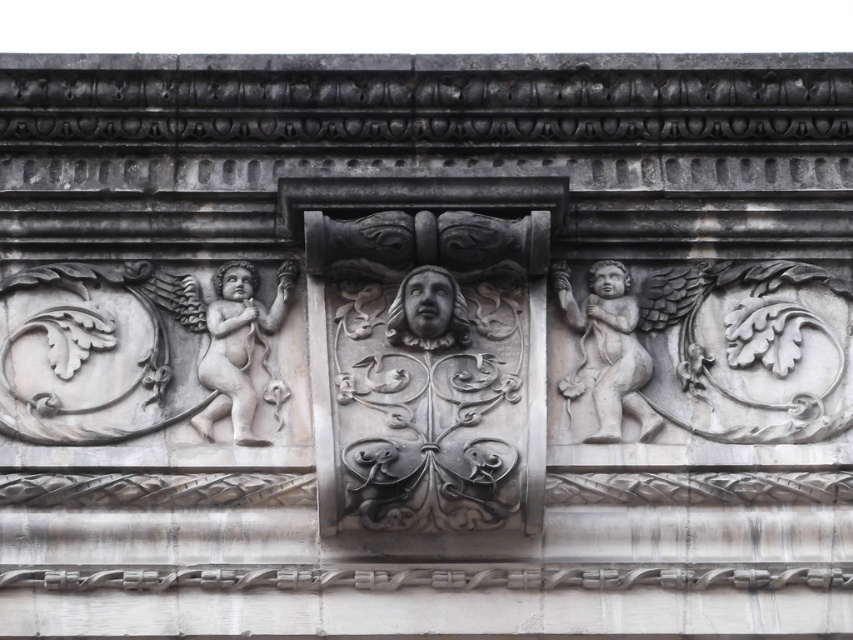
Which is more to the left, white stone cherub at center or gray stone face at center?

gray stone face at center is more to the left.

Between point (619, 337) and point (459, 317), which one is positioned behind?

The point (619, 337) is more distant.

I want to click on white stone cherub at center, so click(x=606, y=349).

Is white stone cherub at left positioned behind white stone cherub at center?

No, it is not.

Between point (260, 353) and point (613, 432), which one is positioned behind?

Point (260, 353)

Locate an element on the screen. This screenshot has width=853, height=640. white stone cherub at left is located at coordinates (241, 348).

Find the location of a particular element. The height and width of the screenshot is (640, 853). white stone cherub at left is located at coordinates (241, 348).

Is white stone cherub at left to the right of gray stone face at center from the viewer's perspective?

Incorrect, white stone cherub at left is not on the right side of gray stone face at center.

Between point (227, 291) and point (426, 330), which one is positioned behind?

Point (227, 291)

Where is `white stone cherub at left`? Image resolution: width=853 pixels, height=640 pixels. white stone cherub at left is located at coordinates 241,348.